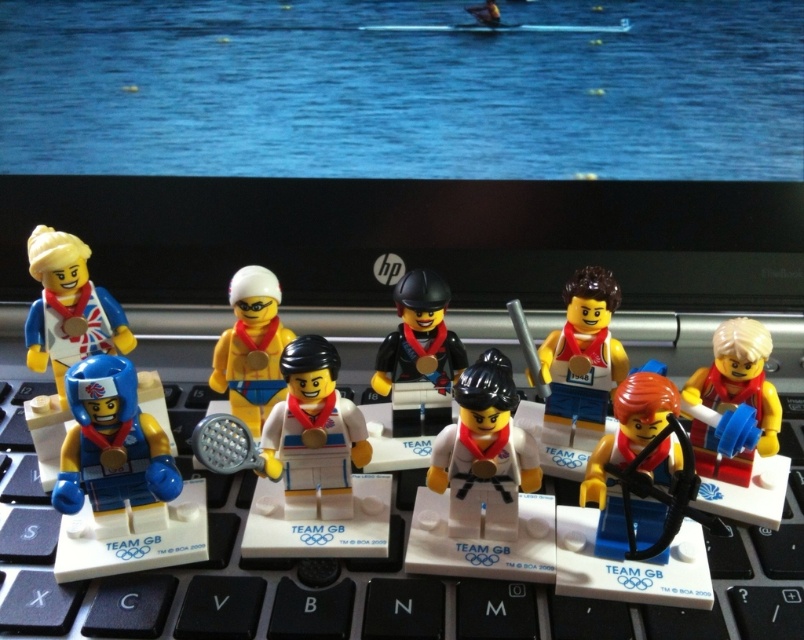
You are a photographer setting up a shot of the LEGO minifigures on the keyboard. You want to focus on the blue matte helmet at left and the matte yellow minifigure at right. Which object should you adjust to be closer to the camera to ensure both are in focus?

The blue matte helmet at left is already closer to the viewer than the matte yellow minifigure at right. To ensure both are in focus, you should move the matte yellow minifigure at right closer to the camera so it aligns with the distance of the blue matte helmet at left.

You are organizing a display of Team GB LEGO athletes on a desk. You need to place a new LEGO figure between the shiny orange helmet at center and the white matte tennis racket at center. Which side of the tennis racket should the new figure be placed on?

The shiny orange helmet at center is to the right of the white matte tennis racket at center, so the new figure should be placed to the right side of the tennis racket.